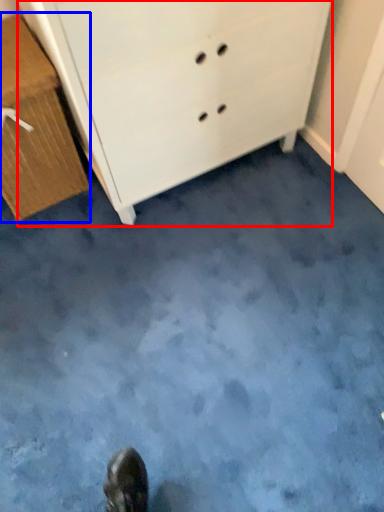
Question: Which object appears farthest to the camera in this image, chest of drawers (highlighted by a red box) or chest of drawers (highlighted by a blue box)?

Choices:
 (A) chest of drawers
 (B) chest of drawers

Answer: (B)